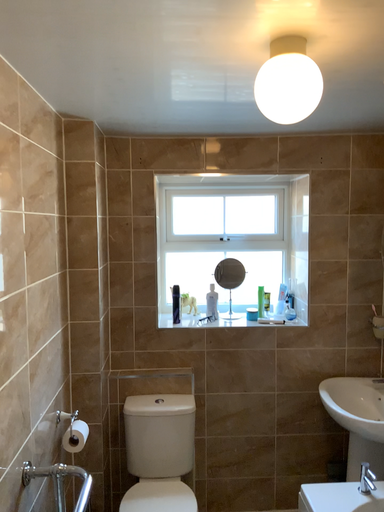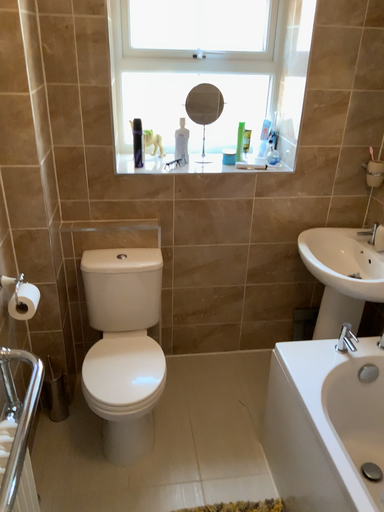
Question: Which way did the camera rotate in the video?

Choices:
 (A) rotated downward
 (B) rotated upward

Answer: (A)